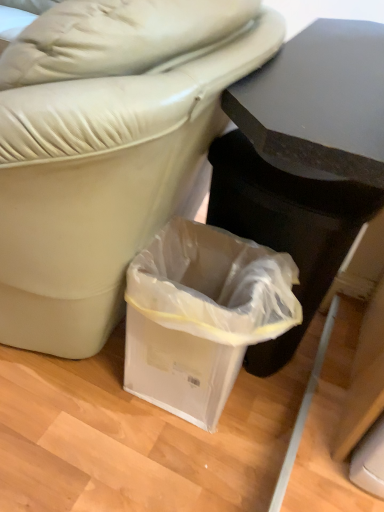
From the picture: In order to face black matte table at upper right, should I rotate leftwards or rightwards?

You should look right and rotate roughly 17.295 degrees.

Identify the location of black matte table at upper right. The width and height of the screenshot is (384, 512). (304, 160).

This screenshot has height=512, width=384. Describe the element at coordinates (304, 160) in the screenshot. I see `black matte table at upper right` at that location.

I want to click on translucent plastic bag at lower center, so click(201, 315).

In order to face translucent plastic bag at lower center, should I rotate leftwards or rightwards?

To align with it, rotate right about 2.171°.

This screenshot has width=384, height=512. What do you see at coordinates (201, 315) in the screenshot?
I see `translucent plastic bag at lower center` at bounding box center [201, 315].

At what (x,y) coordinates should I click in order to perform the action: click on black matte table at upper right. Please return your answer as a coordinate pair (x, y). Looking at the image, I should click on (304, 160).

Which object is positioned more to the left, black matte table at upper right or translucent plastic bag at lower center?

Positioned to the left is translucent plastic bag at lower center.

Consider the image. Between black matte table at upper right and translucent plastic bag at lower center, which one is positioned behind?

translucent plastic bag at lower center is further away from the camera.

Which is less distant, (288, 193) or (152, 365)?

Point (288, 193).

From the image's perspective, is black matte table at upper right over translucent plastic bag at lower center?

Yes, from the image's perspective, black matte table at upper right is on top of translucent plastic bag at lower center.

Consider the image. From a real-world perspective, does black matte table at upper right sit lower than translucent plastic bag at lower center?

No, from a real-world perspective, black matte table at upper right is not under translucent plastic bag at lower center.

Consider the image. Considering the relative sizes of black matte table at upper right and translucent plastic bag at lower center in the image provided, is black matte table at upper right thinner than translucent plastic bag at lower center?

No.

Who is taller, black matte table at upper right or translucent plastic bag at lower center?

With more height is black matte table at upper right.

Is black matte table at upper right smaller than translucent plastic bag at lower center?

No, black matte table at upper right is not smaller than translucent plastic bag at lower center.

Is black matte table at upper right not within translucent plastic bag at lower center?

Yes, black matte table at upper right is located beyond the bounds of translucent plastic bag at lower center.

Is black matte table at upper right next to translucent plastic bag at lower center and touching it?

No, black matte table at upper right is not next to translucent plastic bag at lower center.

In the scene shown: Is black matte table at upper right aimed at translucent plastic bag at lower center?

Yes, black matte table at upper right is oriented towards translucent plastic bag at lower center.

What's the angular difference between black matte table at upper right and translucent plastic bag at lower center's facing directions?

The facing directions of black matte table at upper right and translucent plastic bag at lower center are 0.000631 degrees apart.

Locate an element on the screen. waste container that appears below the black matte table at upper right (from a real-world perspective) is located at coordinates (201, 315).

Considering the positions of objects translucent plastic bag at lower center and black matte table at upper right in the image provided, who is more to the right, translucent plastic bag at lower center or black matte table at upper right?

black matte table at upper right.

In the scene shown: Is translucent plastic bag at lower center behind black matte table at upper right?

Yes, it is behind black matte table at upper right.

Which point is more distant from viewer, (213,338) or (272,367)?

Point (272,367)

From the image's perspective, relative to black matte table at upper right, is translucent plastic bag at lower center above or below?

From the image's perspective, translucent plastic bag at lower center appears below black matte table at upper right.

From a real-world perspective, which is physically below, translucent plastic bag at lower center or black matte table at upper right?

In real-world perspective, translucent plastic bag at lower center is lower.

Which of these two, translucent plastic bag at lower center or black matte table at upper right, is thinner?

Thinner between the two is translucent plastic bag at lower center.

Consider the image. Considering the sizes of objects translucent plastic bag at lower center and black matte table at upper right in the image provided, who is taller, translucent plastic bag at lower center or black matte table at upper right?

black matte table at upper right.

Which of these two, translucent plastic bag at lower center or black matte table at upper right, is smaller?

translucent plastic bag at lower center.

Is translucent plastic bag at lower center inside the boundaries of black matte table at upper right, or outside?

translucent plastic bag at lower center fits inside black matte table at upper right.

Would you say translucent plastic bag at lower center is a long distance from black matte table at upper right?

That's not correct — translucent plastic bag at lower center is a little close to black matte table at upper right.

Is translucent plastic bag at lower center facing towards black matte table at upper right?

Yes, translucent plastic bag at lower center is oriented towards black matte table at upper right.

This screenshot has height=512, width=384. In the image, there is a translucent plastic bag at lower center. Identify the location of table above it (from the image's perspective). (304, 160).

I want to click on table on the right of translucent plastic bag at lower center, so click(x=304, y=160).

I want to click on table in front of the translucent plastic bag at lower center, so click(x=304, y=160).